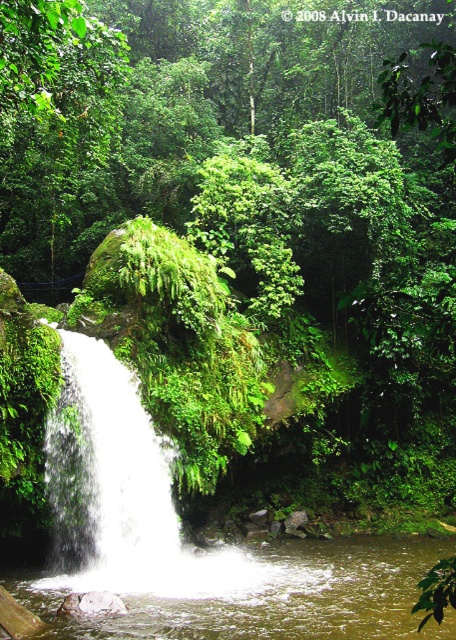
You are a hiker who wants to cross the river near the waterfall. You see clear water at center and white frothy water at left. Which part of the water would be safer to cross?

The clear water at center is safer to cross because it is not as tall as the white frothy water at left, indicating it might be shallower and less turbulent.

You are standing in the forest and want to take a photo of the clear water at center and the white frothy water at left. Which one should you focus on first if you want both to be in focus?

You should focus on the white frothy water at left first because it is farther away from the viewer than the clear water at center, so adjusting focus from far to near can help both be in focus.